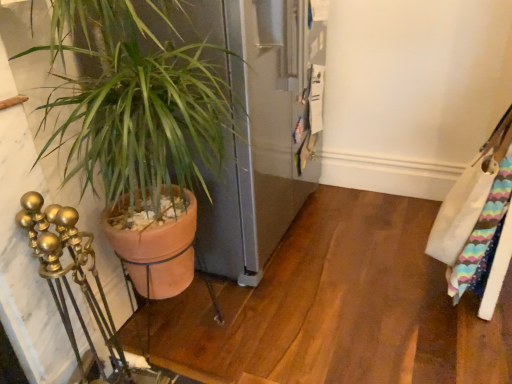
Where is `vacant space in terracotta pot at left (from a real-world perspective)`? vacant space in terracotta pot at left (from a real-world perspective) is located at coordinates (198, 339).